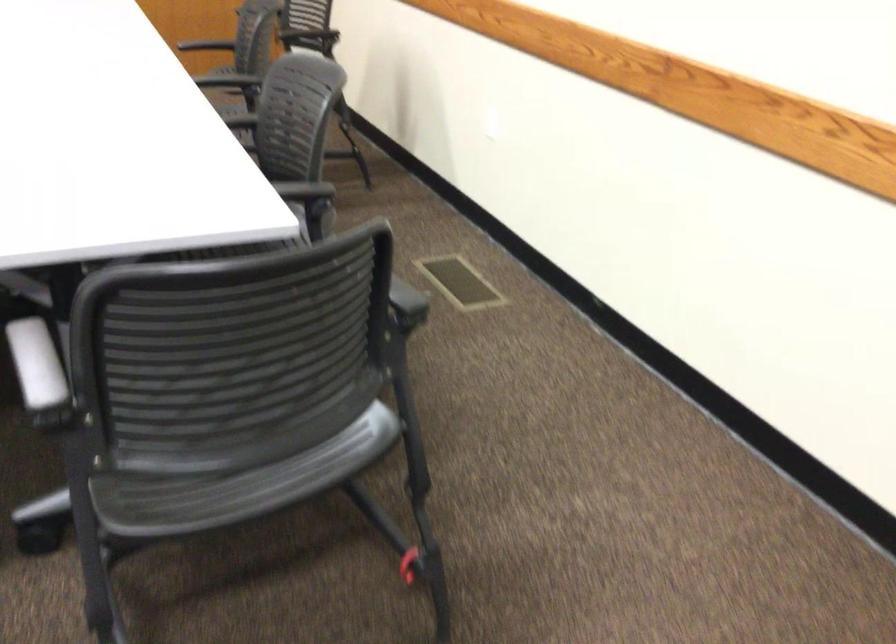
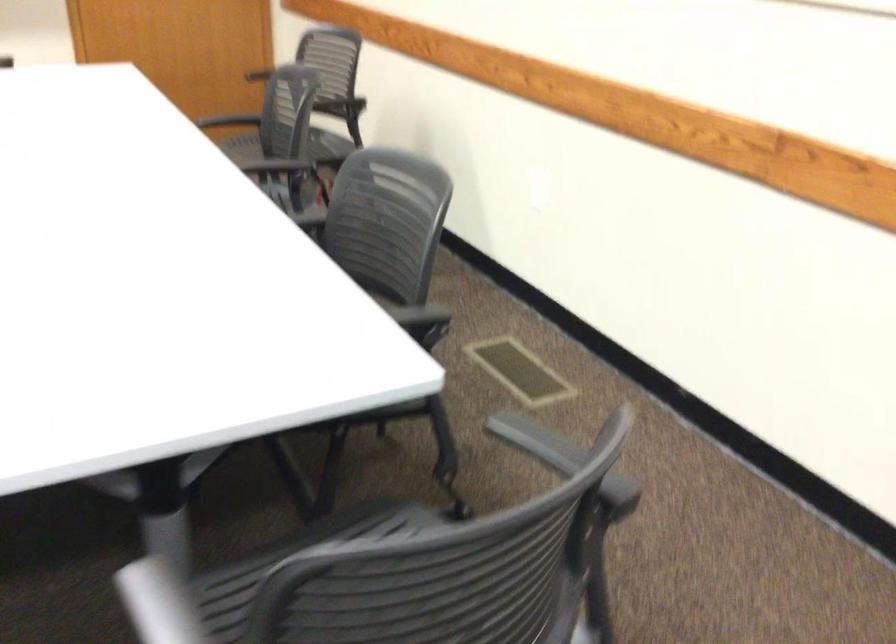
The point at (x=458, y=279) is marked in the first image. Where is the corresponding point in the second image?

(520, 370)